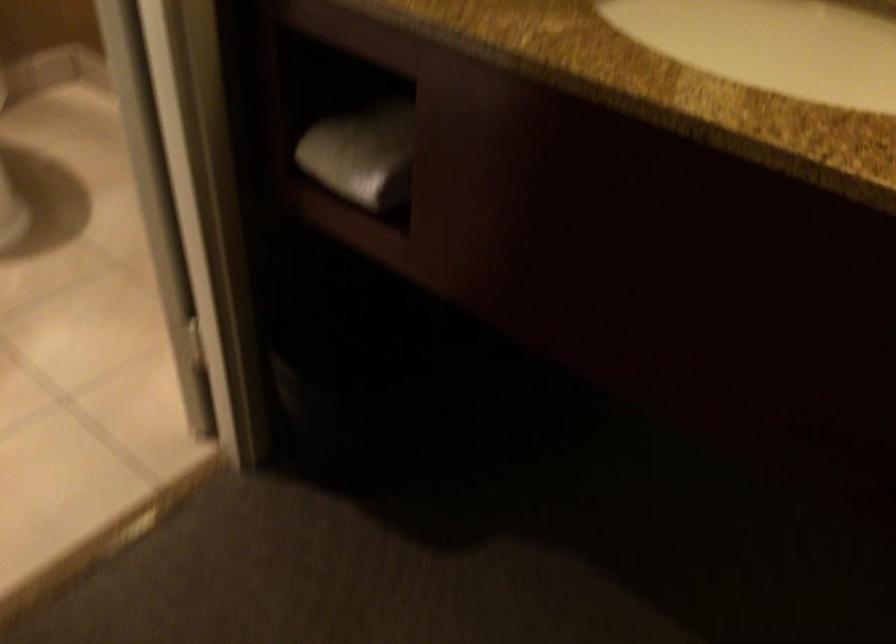
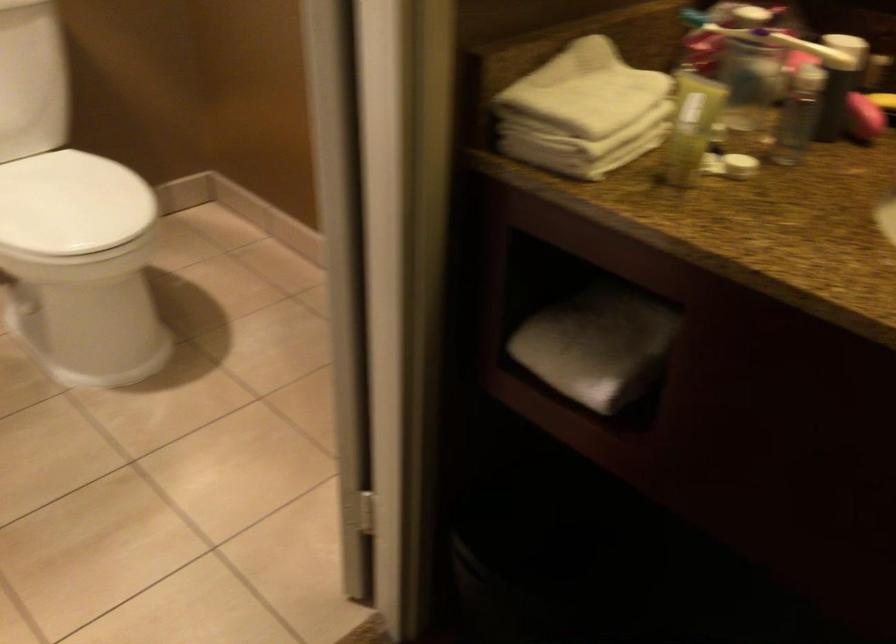
Question: In a continuous first-person perspective shot, in which direction is the camera moving?

Choices:
 (A) Left
 (B) Right
 (C) Forward
 (D) Backward

Answer: (A)